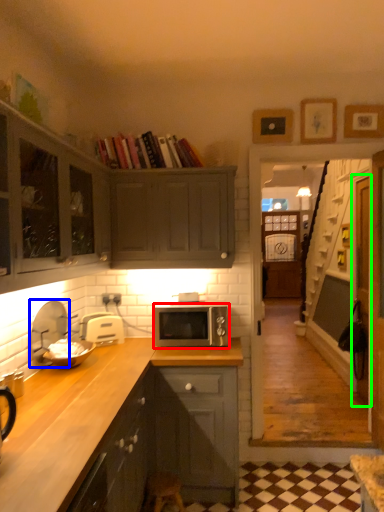
Question: Estimate the real-world distances between objects in this image. Which object is farther from microwave oven (highlighted by a red box), appliance (highlighted by a blue box) or glass door (highlighted by a green box)?

Choices:
 (A) appliance
 (B) glass door

Answer: (B)